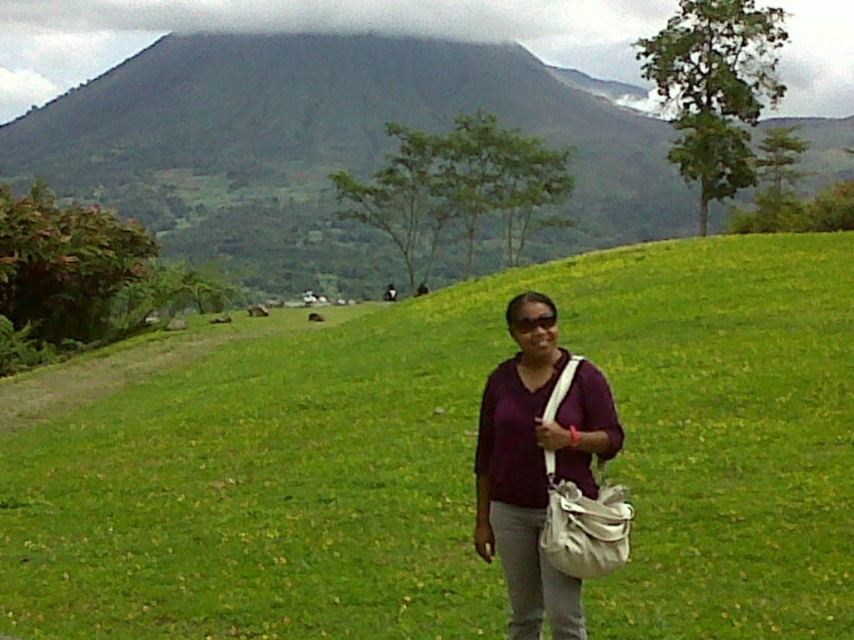
Question: Which object is farther from the camera taking this photo?

Choices:
 (A) light gray canvas bag at center
 (B) green grassy hillside at center

Answer: (B)

Question: Is purple matte shirt at center positioned at the back of light gray canvas bag at center?

Choices:
 (A) yes
 (B) no

Answer: (A)

Question: Is the position of green grassy hillside at center more distant than that of light gray canvas bag at center?

Choices:
 (A) yes
 (B) no

Answer: (A)

Question: Is purple matte shirt at center to the right of light gray canvas bag at center from the viewer's perspective?

Choices:
 (A) yes
 (B) no

Answer: (B)

Question: Among these points, which one is farthest from the camera?

Choices:
 (A) (215, 36)
 (B) (154, 529)
 (C) (512, 600)

Answer: (A)

Question: Considering the real-world distances, which object is closest to the green grassy field at center?

Choices:
 (A) light gray canvas bag at center
 (B) purple matte shirt at center
 (C) green grassy hillside at center

Answer: (A)